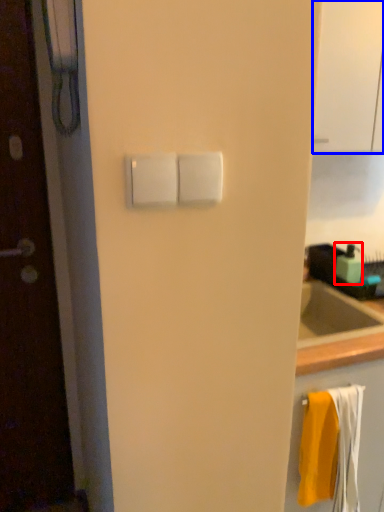
Question: Among these objects, which one is nearest to the camera, soap dispenser (highlighted by a red box) or glass door (highlighted by a blue box)?

Choices:
 (A) soap dispenser
 (B) glass door

Answer: (B)